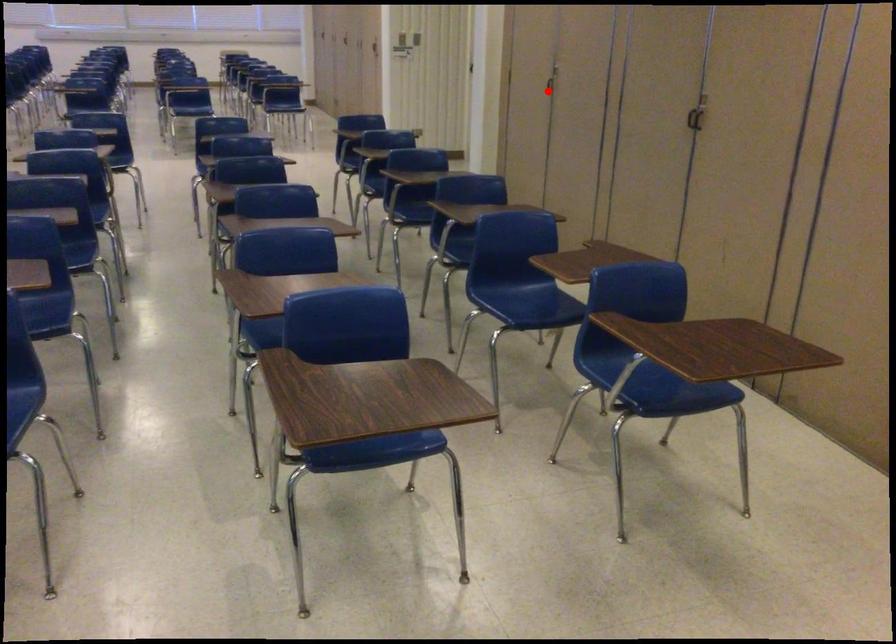
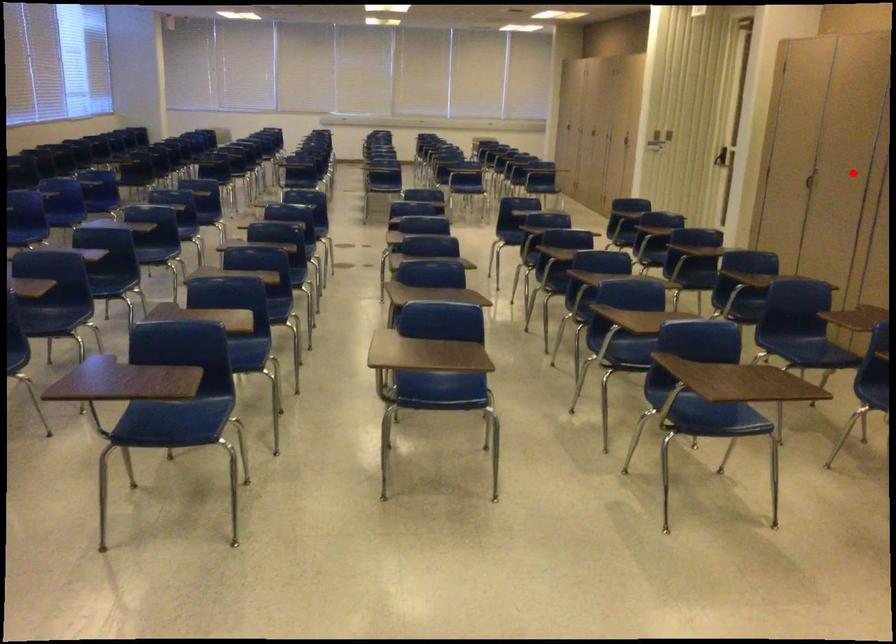
I am providing you with two images of the same scene from different viewpoints. A red point is marked on the first image and another point is marked on the second image. Is the red point in image1 aligned with the point shown in image2?

No